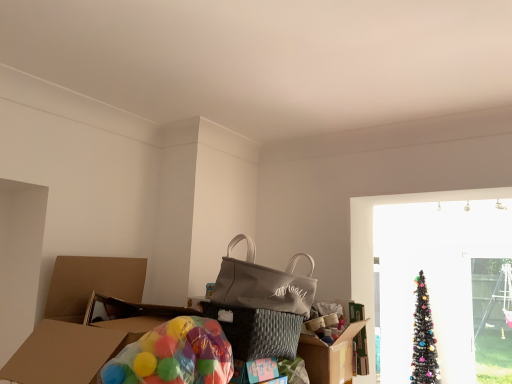
Question: Is translucent plastic balloons at lower left turned away from black glittery christmas tree at right?

Choices:
 (A) no
 (B) yes

Answer: (A)

Question: From a real-world perspective, is translucent plastic balloons at lower left over black glittery christmas tree at right?

Choices:
 (A) yes
 (B) no

Answer: (A)

Question: Considering the relative positions of translucent plastic balloons at lower left and black glittery christmas tree at right in the image provided, is translucent plastic balloons at lower left in front of black glittery christmas tree at right?

Choices:
 (A) no
 (B) yes

Answer: (B)

Question: Can you confirm if translucent plastic balloons at lower left is positioned to the left of black glittery christmas tree at right?

Choices:
 (A) no
 (B) yes

Answer: (B)

Question: From the image's perspective, is translucent plastic balloons at lower left below black glittery christmas tree at right?

Choices:
 (A) yes
 (B) no

Answer: (B)

Question: Considering the positions of matte gray tote bag at center and black glittery christmas tree at right in the image, is matte gray tote bag at center wider or thinner than black glittery christmas tree at right?

Choices:
 (A) wide
 (B) thin

Answer: (B)

Question: Is matte gray tote bag at center in front of or behind black glittery christmas tree at right in the image?

Choices:
 (A) behind
 (B) front

Answer: (B)

Question: Would you say matte gray tote bag at center is inside or outside black glittery christmas tree at right?

Choices:
 (A) inside
 (B) outside

Answer: (B)

Question: From a real-world perspective, is matte gray tote bag at center above or below black glittery christmas tree at right?

Choices:
 (A) below
 (B) above

Answer: (B)

Question: Is transparent plastic screen door at right wider or thinner than translucent plastic balloons at lower left?

Choices:
 (A) wide
 (B) thin

Answer: (B)

Question: Considering their positions, is transparent plastic screen door at right located in front of or behind translucent plastic balloons at lower left?

Choices:
 (A) front
 (B) behind

Answer: (B)

Question: From the image's perspective, relative to translucent plastic balloons at lower left, is transparent plastic screen door at right above or below?

Choices:
 (A) below
 (B) above

Answer: (A)

Question: Based on their sizes in the image, would you say transparent plastic screen door at right is bigger or smaller than translucent plastic balloons at lower left?

Choices:
 (A) small
 (B) big

Answer: (B)

Question: Based on their sizes in the image, would you say translucent plastic balloons at lower left is bigger or smaller than matte gray tote bag at center?

Choices:
 (A) big
 (B) small

Answer: (B)

Question: Is translucent plastic balloons at lower left situated inside matte gray tote bag at center or outside?

Choices:
 (A) outside
 (B) inside

Answer: (A)